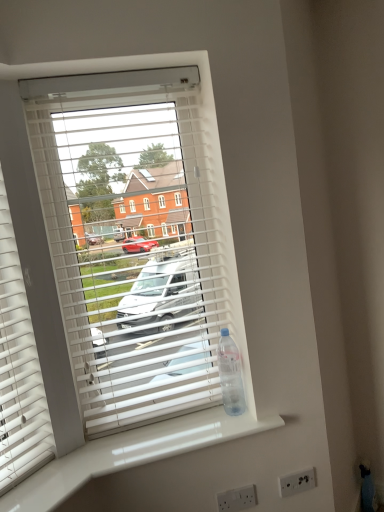
Question: From the image's perspective, would you say white glossy counter top at lower center is positioned over white plastic blinds at center?

Choices:
 (A) yes
 (B) no

Answer: (B)

Question: Is white glossy counter top at lower center at the right side of white plastic blinds at center?

Choices:
 (A) yes
 (B) no

Answer: (A)

Question: Does white glossy counter top at lower center appear on the left side of white plastic blinds at center?

Choices:
 (A) yes
 (B) no

Answer: (B)

Question: From a real-world perspective, does white glossy counter top at lower center sit lower than white plastic blinds at center?

Choices:
 (A) yes
 (B) no

Answer: (A)

Question: From a real-world perspective, is white glossy counter top at lower center positioned over white plastic blinds at center based on gravity?

Choices:
 (A) no
 (B) yes

Answer: (A)

Question: Is point (288, 490) closer or farther from the camera than point (39, 150)?

Choices:
 (A) farther
 (B) closer

Answer: (A)

Question: From the image's perspective, is white plastic electric outlet at lower right, arranged as the 2th electric outlet when viewed from the left, positioned above or below white plastic blinds at center?

Choices:
 (A) below
 (B) above

Answer: (A)

Question: From their relative heights in the image, would you say white plastic electric outlet at lower right, the 1th electric outlet when ordered from right to left, is taller or shorter than white plastic blinds at center?

Choices:
 (A) short
 (B) tall

Answer: (A)

Question: Is white plastic electric outlet at lower right, the 1th electric outlet when ordered from right to left, in front of or behind white plastic blinds at center in the image?

Choices:
 (A) behind
 (B) front

Answer: (A)

Question: From a real-world perspective, is clear plastic bottle at right physically located above or below white plastic electric outlet at lower center, the 1th electric outlet when ordered from front to back?

Choices:
 (A) below
 (B) above

Answer: (B)

Question: Considering the relative positions of clear plastic bottle at right and white plastic electric outlet at lower center, the 1th electric outlet when ordered from front to back, in the image provided, is clear plastic bottle at right to the left or to the right of white plastic electric outlet at lower center, the 1th electric outlet when ordered from front to back,?

Choices:
 (A) left
 (B) right

Answer: (A)

Question: Is clear plastic bottle at right taller or shorter than white plastic electric outlet at lower center, the first electric outlet when ordered from left to right?

Choices:
 (A) tall
 (B) short

Answer: (A)

Question: In the image, is clear plastic bottle at right positioned in front of or behind white plastic electric outlet at lower center, the first electric outlet when ordered from left to right?

Choices:
 (A) front
 (B) behind

Answer: (A)

Question: Considering their positions, is white plastic blinds at center located in front of or behind white glossy counter top at lower center?

Choices:
 (A) behind
 (B) front

Answer: (A)

Question: Does point (33, 81) appear closer or farther from the camera than point (46, 500)?

Choices:
 (A) farther
 (B) closer

Answer: (A)